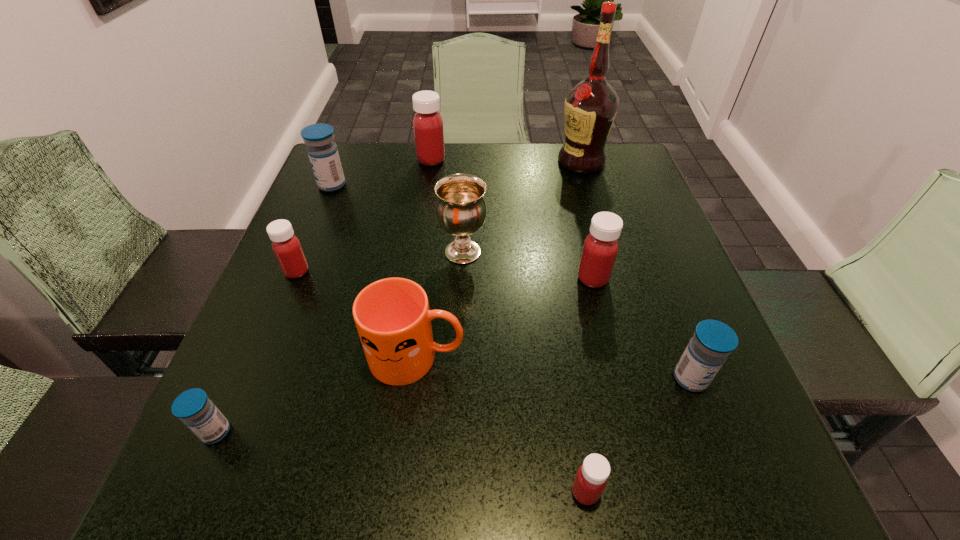
The width and height of the screenshot is (960, 540). Find the location of `vacant space situated on the front of the second red medicine from left to right`. vacant space situated on the front of the second red medicine from left to right is located at coordinates (427, 185).

Find the location of a particular element. The height and width of the screenshot is (540, 960). free space located on the right of the chalice is located at coordinates (588, 252).

What are the coordinates of `vacant region located 0.300m on the front of the biggest blue medicine` in the screenshot? It's located at (294, 280).

At what (x,y) coordinates should I click in order to perform the action: click on free space located 0.300m on the front of the third smallest red medicine. Please return your answer as a coordinate pair (x, y). Image resolution: width=960 pixels, height=540 pixels. Looking at the image, I should click on (632, 436).

Locate an element on the screen. vacant area situated on the handle side of the mug is located at coordinates (493, 357).

Identify the location of free region located on the back of the rightmost medicine. click(661, 302).

Find the location of `vacant space located 0.110m on the front of the leftmost red medicine`. vacant space located 0.110m on the front of the leftmost red medicine is located at coordinates (276, 323).

Locate an element on the screen. vacant region located on the right of the smallest blue medicine is located at coordinates (395, 432).

Locate an element on the screen. The width and height of the screenshot is (960, 540). vacant area located 0.320m on the left of the nearest red medicine is located at coordinates (341, 492).

You are a GUI agent. You are given a task and a screenshot of the screen. Output one action in this format:
    pyautogui.click(x=<x>, y=<y>)
    Task: Click on the alcohol that is positioned at the far edge
    
    Given the screenshot: What is the action you would take?
    pyautogui.click(x=590, y=106)